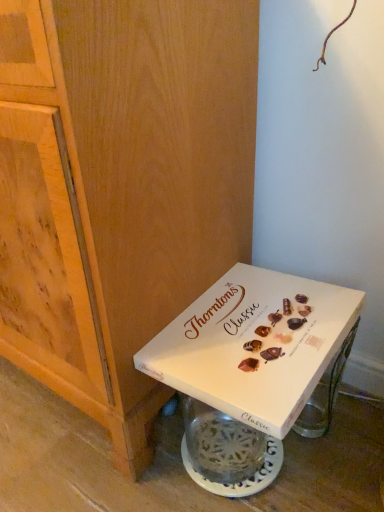
This screenshot has width=384, height=512. In order to click on free space above white cardboard box at lower right (from a real-world perspective) in this screenshot , I will do `click(275, 315)`.